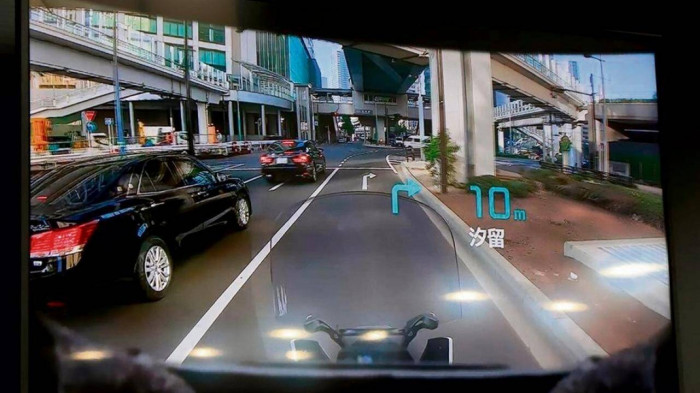
Where is `windows`? windows is located at coordinates (54, 181), (153, 178), (196, 170), (281, 146), (316, 148).